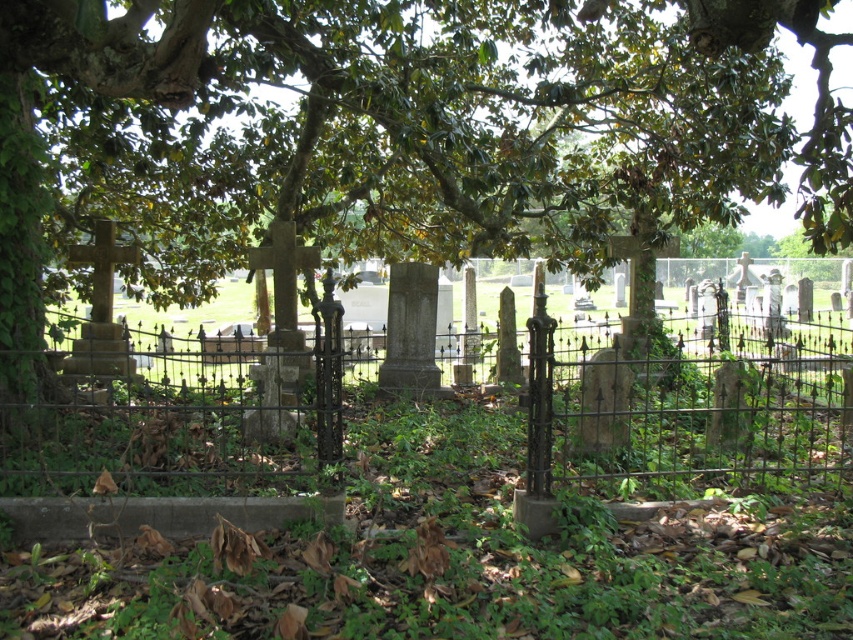
Question: Is green leafy tree at center positioned before rusty iron fence at center?

Choices:
 (A) yes
 (B) no

Answer: (A)

Question: Among these objects, which one is nearest to the camera?

Choices:
 (A) green leafy tree at center
 (B) rusty iron fence at center

Answer: (A)

Question: Which of the following is the closest to the observer?

Choices:
 (A) (108, 412)
 (B) (399, 205)

Answer: (A)

Question: Considering the relative positions of green leafy tree at center and rusty iron fence at center in the image provided, where is green leafy tree at center located with respect to rusty iron fence at center?

Choices:
 (A) left
 (B) right

Answer: (A)

Question: Which point appears farthest from the camera in this image?

Choices:
 (A) (541, 356)
 (B) (544, 147)

Answer: (B)

Question: Does green leafy tree at center appear under rusty iron fence at center?

Choices:
 (A) yes
 (B) no

Answer: (B)